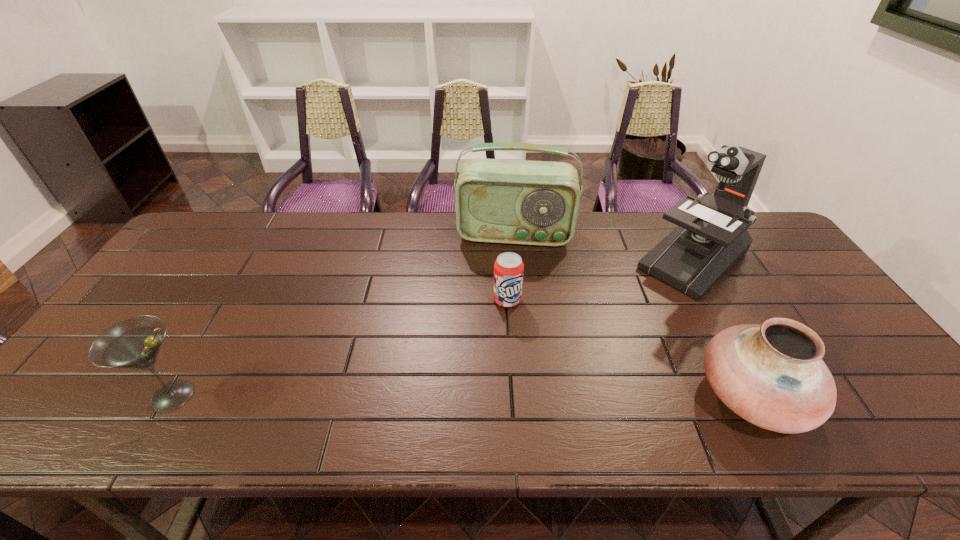
Identify the location of free space on the desktop that is between the martini and the pottery and is positioned on the surface of the soda can. (533, 395).

At what (x,y) coordinates should I click in order to perform the action: click on free space on the desktop that is between the leftmost object and the pottery and is positioned through the eyepieces of the tallest object. Please return your answer as a coordinate pair (x, y). Looking at the image, I should click on [x=541, y=395].

Locate an element on the screen. The height and width of the screenshot is (540, 960). free space on the desktop that is between the martini and the pottery and is positioned on the front panel of the radio receiver is located at coordinates (504, 395).